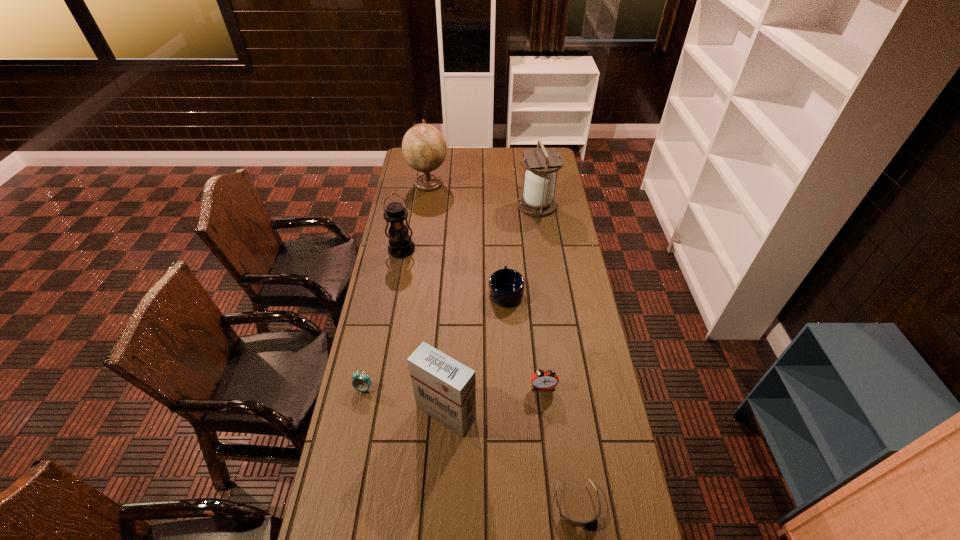
Where is `globe`? Image resolution: width=960 pixels, height=540 pixels. globe is located at coordinates (424, 148).

Locate an element on the screen. The image size is (960, 540). the farther lantern is located at coordinates (538, 200).

The height and width of the screenshot is (540, 960). I want to click on the nearer lantern, so click(401, 245).

The image size is (960, 540). In order to click on the third farthest object in this screenshot , I will do [x=401, y=245].

I want to click on cigarette case, so click(x=444, y=388).

At what (x,y) coordinates should I click in order to perform the action: click on the fourth shortest object. Please return your answer as a coordinate pair (x, y). This screenshot has height=540, width=960. Looking at the image, I should click on (543, 380).

At what (x,y) coordinates should I click in order to perform the action: click on the right alarm clock. Please return your answer as a coordinate pair (x, y). Looking at the image, I should click on (543, 380).

Locate an element on the screen. The width and height of the screenshot is (960, 540). the fifth nearest object is located at coordinates (506, 286).

I want to click on the shorter alarm clock, so click(361, 382).

Image resolution: width=960 pixels, height=540 pixels. Find the location of `the nearest object`. the nearest object is located at coordinates (576, 523).